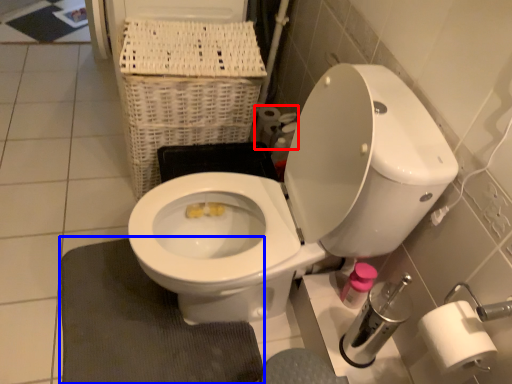
Question: Among these objects, which one is farthest to the camera, toilet paper (highlighted by a red box) or bath mat (highlighted by a blue box)?

Choices:
 (A) toilet paper
 (B) bath mat

Answer: (A)